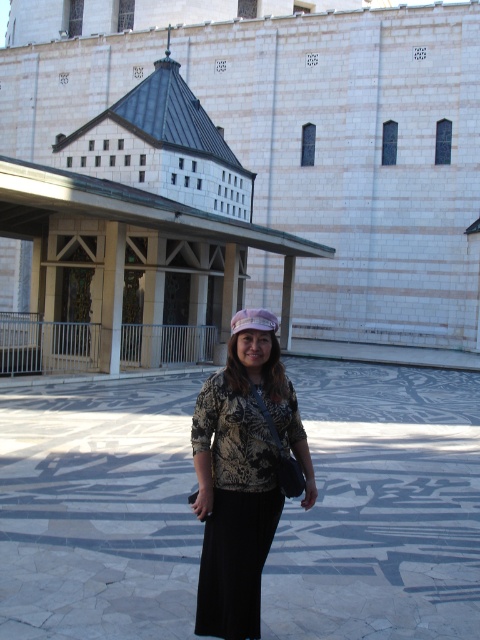
You are a fashion designer observing a model wearing both the printed fabric blouse at center and the matte pink fabric hat at center. Which item of clothing is smaller in size?

The printed fabric blouse at center has a smaller size compared to the matte pink fabric hat at center.

Looking at this image, you are taking a photo of the building and want to focus on two points on the facade. The first point is at coordinates point (218, 538) and the second point is at point (273, 321). Which point should you focus on first to ensure it is in sharp focus?

Point (218, 538) is closer to the camera than point (273, 321), so you should focus on point (218, 538) first to ensure it is in sharp focus.

You are a fashion designer observing a model wearing the printed fabric blouse at center and the matte pink fabric hat at center. Which item is closer to the camera?

The printed fabric blouse at center is closer to the camera because it is in front of the matte pink fabric hat at center.